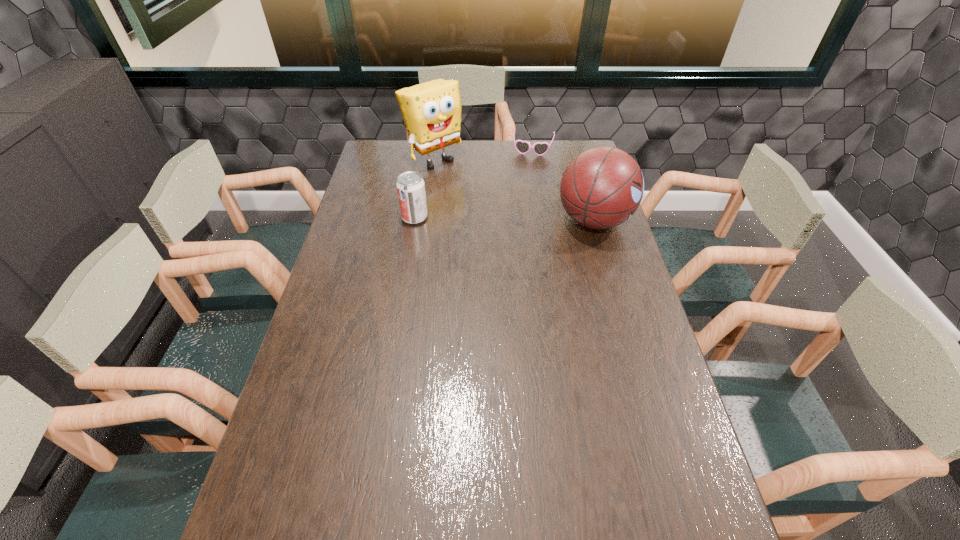
Identify the location of object that stands as the third closest to the tallest object. (601, 188).

I want to click on the third closest object to the sponge, so click(601, 188).

What are the coordinates of `free spot that satisfies the following two spatial constraints: 1. on the front side of the basketball; 2. on the right side of the sponge` in the screenshot? It's located at (425, 220).

You are a GUI agent. You are given a task and a screenshot of the screen. Output one action in this format:
    pyautogui.click(x=<x>, y=<y>)
    Task: Click on the vacant space that satisfies the following two spatial constraints: 1. on the back side of the second shortest object; 2. on the left side of the sponge
    Image resolution: width=960 pixels, height=540 pixels.
    Given the screenshot: What is the action you would take?
    pyautogui.click(x=424, y=159)

You are a GUI agent. You are given a task and a screenshot of the screen. Output one action in this format:
    pyautogui.click(x=<x>, y=<y>)
    Task: Click on the free location that satisfies the following two spatial constraints: 1. on the back side of the shortest object; 2. on the left side of the sponge
    The width and height of the screenshot is (960, 540).
    Given the screenshot: What is the action you would take?
    pyautogui.click(x=435, y=148)